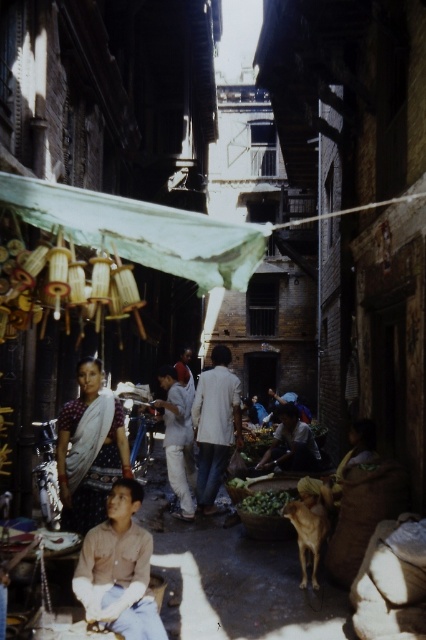
You are a tailor who needs to determine which garment is taller between the light beige fabric coat at center and the light brown cotton shirt at center. Based on the scene, which one is taller?

The light beige fabric coat at center is much taller than the light brown cotton shirt at center, so the light beige fabric coat at center is taller.

You are a delivery person trying to navigate the narrow alleyway. You see the brown cotton shirt at lower left and the green leafy vegetables at center. Which object is positioned higher up in the scene?

The brown cotton shirt at lower left is above the green leafy vegetables at center, so it is positioned higher up in the scene.

You are a delivery person who needs to deliver a package to the light beige fabric coat at center. Your GPS shows a point at coordinates (215, 426). Is this point on the correct location for the package?

Yes, the point at coordinates (215, 426) is on the light beige fabric coat at center, so it is the correct location for the package.